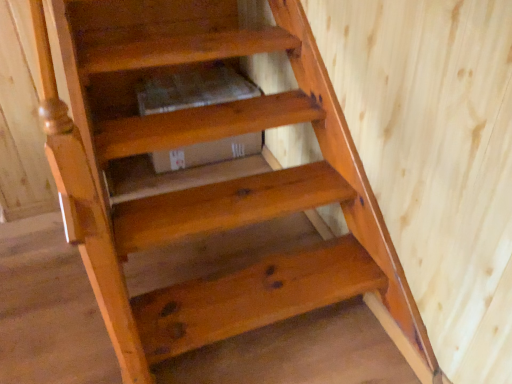
Question: From the image's perspective, does natural wood stair at center, the 2th stairwell positioned from the bottom, appear higher than natural wood stair at lower center, the first stairwell when ordered from bottom to top?

Choices:
 (A) yes
 (B) no

Answer: (A)

Question: Considering the relative positions of natural wood stair at center, the 1th stairwell when ordered from top to bottom, and natural wood stair at lower center, which ranks as the 2th stairwell in top-to-bottom order, in the image provided, is natural wood stair at center, the 1th stairwell when ordered from top to bottom, to the left of natural wood stair at lower center, which ranks as the 2th stairwell in top-to-bottom order, from the viewer's perspective?

Choices:
 (A) no
 (B) yes

Answer: (B)

Question: Is natural wood stair at center, the 2th stairwell positioned from the bottom, behind natural wood stair at lower center, the first stairwell when ordered from bottom to top?

Choices:
 (A) yes
 (B) no

Answer: (A)

Question: From a real-world perspective, is natural wood stair at center, the 1th stairwell when ordered from top to bottom, beneath natural wood stair at lower center, which ranks as the 2th stairwell in top-to-bottom order?

Choices:
 (A) yes
 (B) no

Answer: (B)

Question: Can you confirm if natural wood stair at center, the 1th stairwell when ordered from top to bottom, is shorter than natural wood stair at lower center, which ranks as the 2th stairwell in top-to-bottom order?

Choices:
 (A) yes
 (B) no

Answer: (A)

Question: Is natural wood stair at center, the 2th stairwell positioned from the bottom, positioned far away from natural wood stair at lower center, which ranks as the 2th stairwell in top-to-bottom order?

Choices:
 (A) no
 (B) yes

Answer: (A)

Question: Can you confirm if natural wood stair at lower center, which ranks as the 2th stairwell in top-to-bottom order, is positioned to the right of natural wood stair at center, the 1th stairwell when ordered from top to bottom?

Choices:
 (A) yes
 (B) no

Answer: (A)

Question: From a real-world perspective, is natural wood stair at lower center, the first stairwell when ordered from bottom to top, under natural wood stair at center, the 2th stairwell positioned from the bottom?

Choices:
 (A) yes
 (B) no

Answer: (A)

Question: From a real-world perspective, is natural wood stair at lower center, which ranks as the 2th stairwell in top-to-bottom order, on natural wood stair at center, the 2th stairwell positioned from the bottom?

Choices:
 (A) yes
 (B) no

Answer: (B)

Question: Is natural wood stair at center, the 2th stairwell positioned from the bottom, at the back of natural wood stair at lower center, the first stairwell when ordered from bottom to top?

Choices:
 (A) yes
 (B) no

Answer: (B)

Question: Is natural wood stair at lower center, the first stairwell when ordered from bottom to top, closer to the viewer compared to natural wood stair at center, the 2th stairwell positioned from the bottom?

Choices:
 (A) no
 (B) yes

Answer: (B)

Question: Is natural wood stair at lower center, which ranks as the 2th stairwell in top-to-bottom order, to the left of natural wood stair at center, the 2th stairwell positioned from the bottom, from the viewer's perspective?

Choices:
 (A) yes
 (B) no

Answer: (B)

Question: From a real-world perspective, is natural wood stair at lower center, the first stairwell when ordered from bottom to top, above or below natural wood stair at center, the 1th stairwell when ordered from top to bottom?

Choices:
 (A) above
 (B) below

Answer: (B)